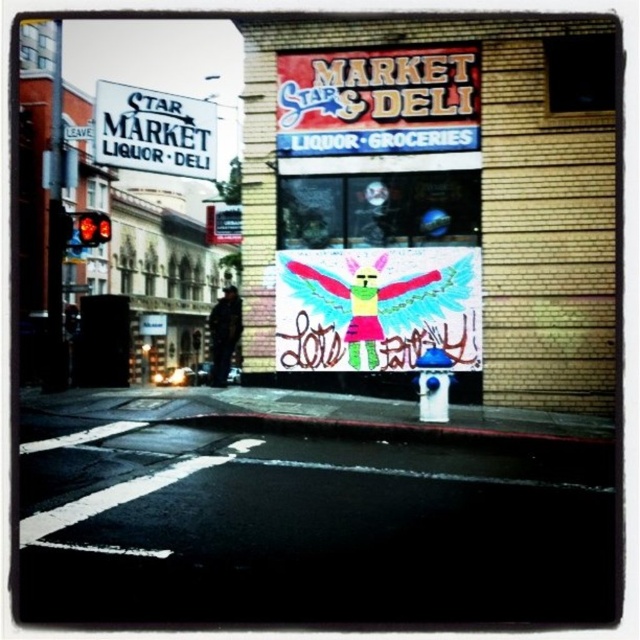
This screenshot has height=640, width=640. What do you see at coordinates (154, 131) in the screenshot? I see `white plastic sign at upper left` at bounding box center [154, 131].

The width and height of the screenshot is (640, 640). I want to click on white plastic sign at upper left, so click(x=154, y=131).

I want to click on white plastic sign at upper left, so click(154, 131).

You are a GUI agent. You are given a task and a screenshot of the screen. Output one action in this format:
    pyautogui.click(x=<x>, y=<y>)
    Task: Click on the white paper sign at center
    
    Given the screenshot: What is the action you would take?
    pyautogui.click(x=435, y=200)

Consider the image. Does white paper sign at center appear over dark blue jacket at center?

Yes.

Which is in front, point (362, 276) or point (220, 333)?

Point (362, 276) is more forward.

Where is `white paper sign at center`? The height and width of the screenshot is (640, 640). white paper sign at center is located at coordinates (435, 200).

Can you confirm if white paper sign at center is positioned to the right of white plastic sign at upper left?

Indeed, white paper sign at center is positioned on the right side of white plastic sign at upper left.

Which is more to the left, white paper sign at center or white plastic sign at upper left?

From the viewer's perspective, white plastic sign at upper left appears more on the left side.

Between point (316, 49) and point (148, 154), which one is positioned behind?

Positioned behind is point (148, 154).

The width and height of the screenshot is (640, 640). Find the location of `white paper sign at center`. white paper sign at center is located at coordinates (435, 200).